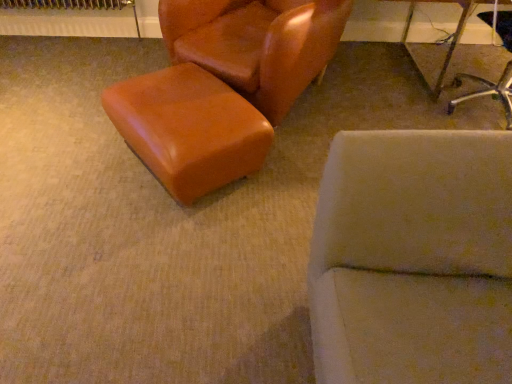
Question: Are metallic silver chair at upper right, marked as the second chair in a left-to-right arrangement, and satin brown ottoman at center located far from each other?

Choices:
 (A) yes
 (B) no

Answer: (A)

Question: Considering the relative sizes of metallic silver chair at upper right, marked as the second chair in a left-to-right arrangement, and satin brown ottoman at center in the image provided, is metallic silver chair at upper right, marked as the second chair in a left-to-right arrangement, wider than satin brown ottoman at center?

Choices:
 (A) no
 (B) yes

Answer: (B)

Question: Is metallic silver chair at upper right, which is the first chair in right-to-left order, oriented away from satin brown ottoman at center?

Choices:
 (A) no
 (B) yes

Answer: (A)

Question: Considering the relative sizes of metallic silver chair at upper right, which is the first chair in right-to-left order, and satin brown ottoman at center in the image provided, is metallic silver chair at upper right, which is the first chair in right-to-left order, thinner than satin brown ottoman at center?

Choices:
 (A) yes
 (B) no

Answer: (B)

Question: Considering the relative sizes of metallic silver chair at upper right, marked as the second chair in a left-to-right arrangement, and satin brown ottoman at center in the image provided, is metallic silver chair at upper right, marked as the second chair in a left-to-right arrangement, taller than satin brown ottoman at center?

Choices:
 (A) no
 (B) yes

Answer: (B)

Question: In the image, is satin brown ottoman at center positioned in front of or behind leather-like brown chair at upper left, the 1th chair viewed from the left?

Choices:
 (A) behind
 (B) front

Answer: (B)

Question: From a real-world perspective, is satin brown ottoman at center positioned above or below leather-like brown chair at upper left, which is the second chair in right-to-left order?

Choices:
 (A) below
 (B) above

Answer: (A)

Question: Is satin brown ottoman at center wider or thinner than leather-like brown chair at upper left, the 1th chair viewed from the left?

Choices:
 (A) thin
 (B) wide

Answer: (A)

Question: Would you say satin brown ottoman at center is to the left or to the right of leather-like brown chair at upper left, the 1th chair viewed from the left, in the picture?

Choices:
 (A) left
 (B) right

Answer: (A)

Question: Is metallic silver chair at upper right, which is the first chair in right-to-left order, inside or outside of satin brown ottoman at center?

Choices:
 (A) inside
 (B) outside

Answer: (B)

Question: In terms of width, does metallic silver chair at upper right, marked as the second chair in a left-to-right arrangement, look wider or thinner when compared to satin brown ottoman at center?

Choices:
 (A) thin
 (B) wide

Answer: (B)

Question: From a real-world perspective, is metallic silver chair at upper right, marked as the second chair in a left-to-right arrangement, physically located above or below satin brown ottoman at center?

Choices:
 (A) below
 (B) above

Answer: (B)

Question: Is point (496, 86) positioned closer to the camera than point (157, 120)?

Choices:
 (A) farther
 (B) closer

Answer: (A)

Question: Does point (501, 29) appear closer or farther from the camera than point (294, 64)?

Choices:
 (A) farther
 (B) closer

Answer: (A)

Question: From the image's perspective, is metallic silver chair at upper right, marked as the second chair in a left-to-right arrangement, positioned above or below leather-like brown chair at upper left, the 1th chair viewed from the left?

Choices:
 (A) below
 (B) above

Answer: (A)